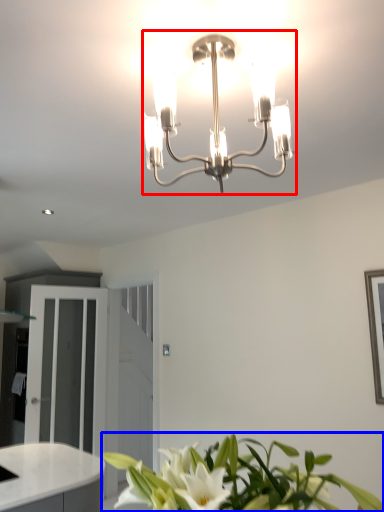
Question: Which of the following is the farthest to the observer, lamp (highlighted by a red box) or houseplant (highlighted by a blue box)?

Choices:
 (A) lamp
 (B) houseplant

Answer: (A)